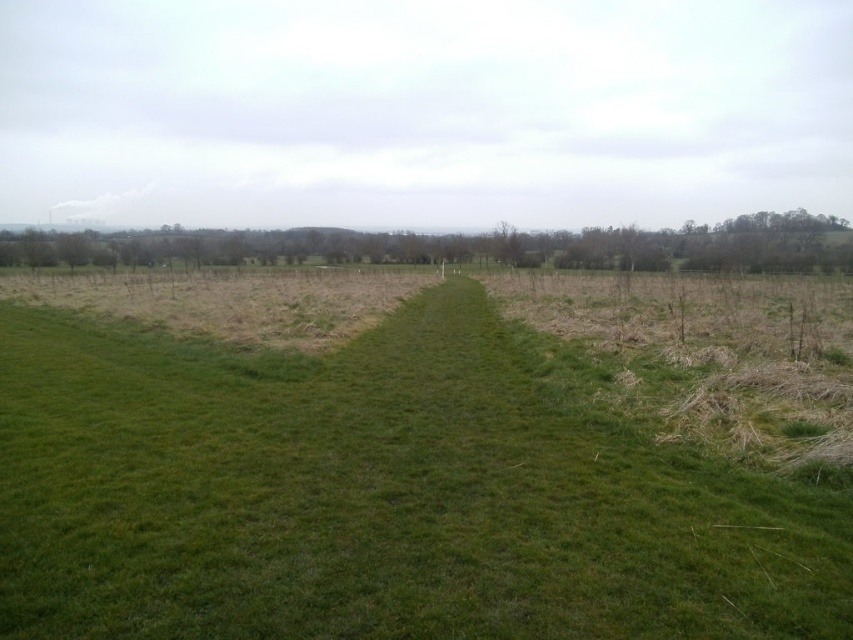
Is green grassy path at center smaller than green grassy field at left?

Indeed, green grassy path at center has a smaller size compared to green grassy field at left.

Can you confirm if green grassy path at center is wider than green grassy field at left?

Incorrect, green grassy path at center's width does not surpass green grassy field at left's.

Is point (485, 339) farther from camera compared to point (618, 244)?

No.

At what (x,y) coordinates should I click in order to perform the action: click on green grassy path at center. Please return your answer as a coordinate pair (x, y). The width and height of the screenshot is (853, 640). Looking at the image, I should click on (379, 496).